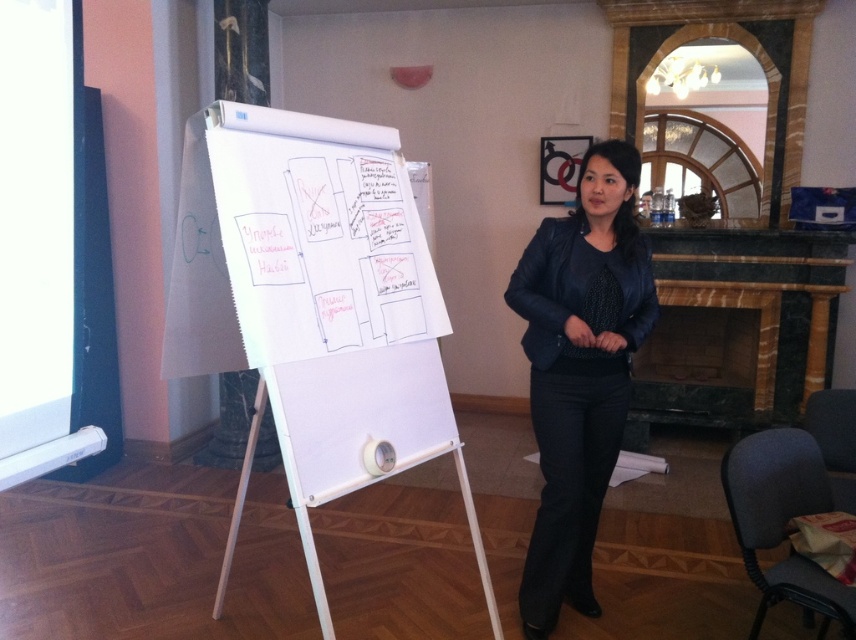
Consider the image. You are an attendee at a meeting and want to take a photo of the white paperboard at center and the matte black jacket at center. Which object should you focus on first if you want to capture both in one frame without moving your camera?

The white paperboard at center is located below the matte black jacket at center, so you should focus on the matte black jacket at center first to ensure both are in the frame.